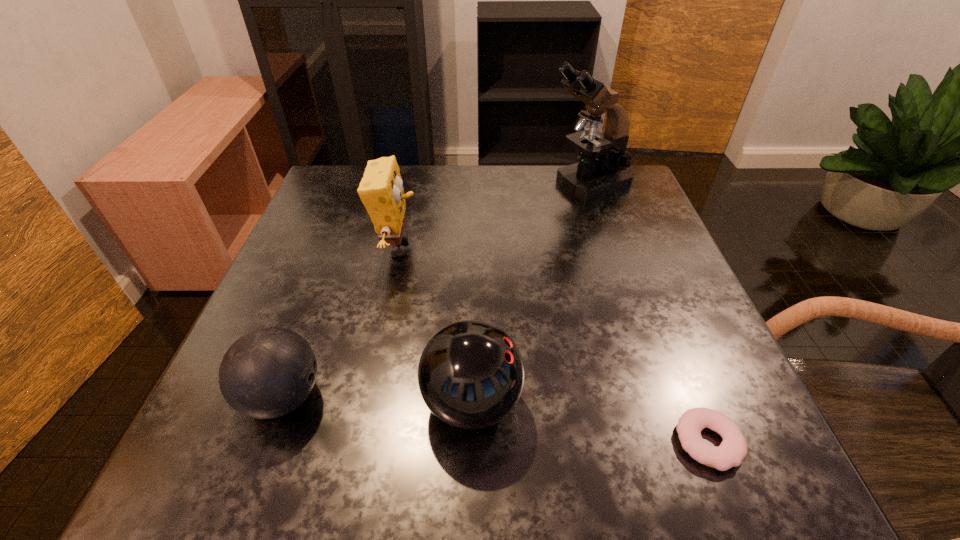
Locate an element on the screen. The height and width of the screenshot is (540, 960). vacant space that satisfies the following two spatial constraints: 1. on the face of the doughnut; 2. on the left side of the sponge is located at coordinates (357, 442).

In order to click on vacant space that satisfies the following two spatial constraints: 1. on the face of the shortest object; 2. on the right side of the sponge in this screenshot , I will do `click(357, 442)`.